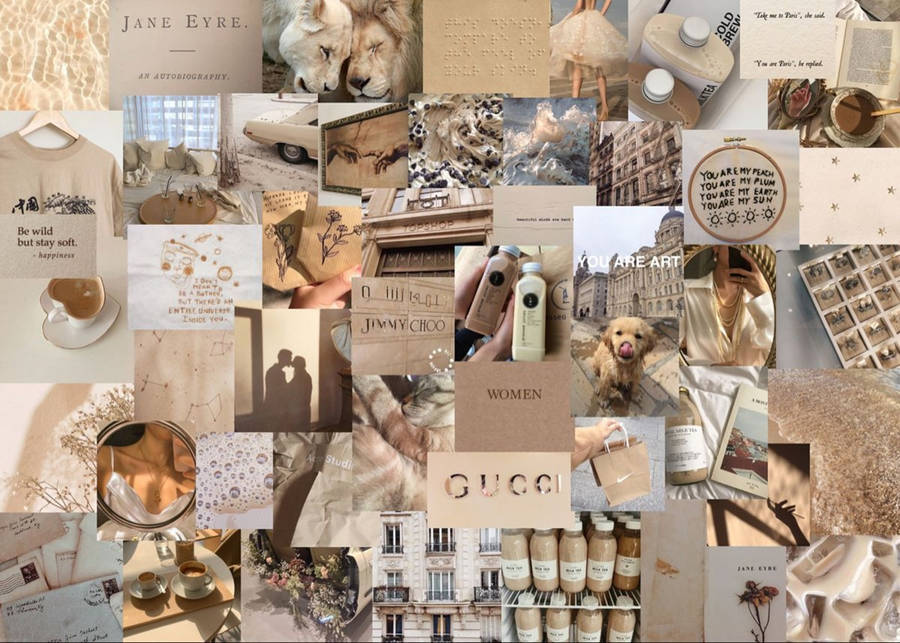
Locate an element on the screen. The width and height of the screenshot is (900, 643). medium bottles is located at coordinates (711, 60), (686, 101), (535, 314), (487, 300), (696, 415), (727, 20).